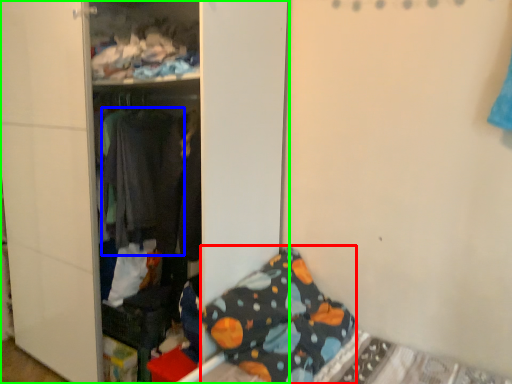
Question: Which is nearer to the pillow (highlighted by a red box)? clothing (highlighted by a blue box) or furniture (highlighted by a green box).

Choices:
 (A) clothing
 (B) furniture

Answer: (B)